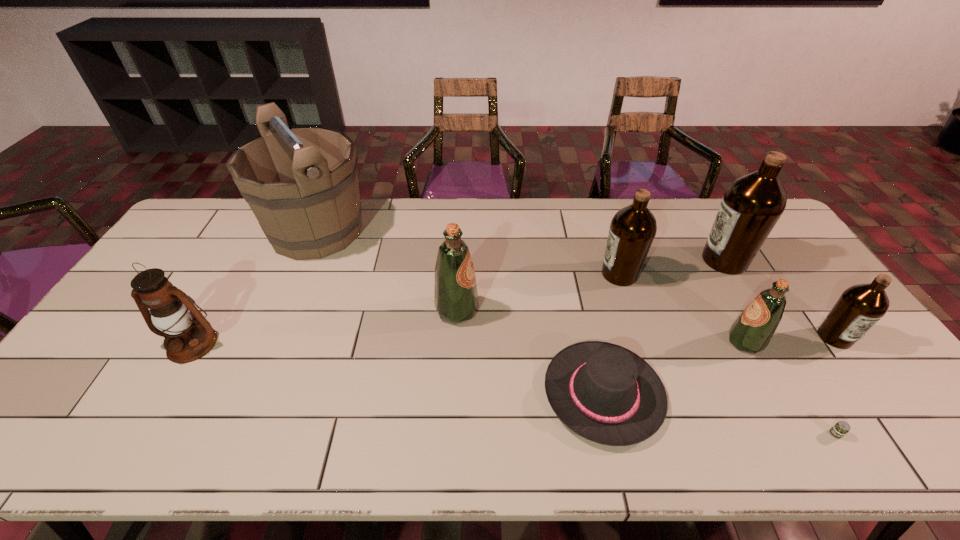
This screenshot has width=960, height=540. Find the location of `vacant point located between the biggest brown olive oil and the second smallest brown olive oil`. vacant point located between the biggest brown olive oil and the second smallest brown olive oil is located at coordinates (672, 267).

This screenshot has height=540, width=960. I want to click on blank region between the leftmost olive oil and the leftmost brown olive oil, so click(x=539, y=292).

At what (x,y) coordinates should I click in order to perform the action: click on free space between the bucket and the second brown olive oil from left to right. Please return your answer as a coordinate pair (x, y). The height and width of the screenshot is (540, 960). Looking at the image, I should click on (520, 246).

The height and width of the screenshot is (540, 960). What are the coordinates of `vacant space that is in between the second brown olive oil from right to left and the beer can` in the screenshot? It's located at (780, 347).

Image resolution: width=960 pixels, height=540 pixels. I want to click on vacant space in between the beer can and the brown lantern, so click(514, 389).

This screenshot has width=960, height=540. In order to click on vacant point located between the rightmost object and the left green olive oil in this screenshot , I will do `click(646, 323)`.

Locate an element on the screen. object that is the fifth closest to the bucket is located at coordinates (752, 331).

I want to click on object that is the sixth closest to the smaller green olive oil, so click(455, 295).

This screenshot has height=540, width=960. I want to click on olive oil identified as the closest to the eighth tallest object, so click(455, 295).

Point out which olive oil is positioned as the third nearest to the smaller green olive oil. Please provide its 2D coordinates. Your answer should be formatted as a tuple, i.e. [(x, y)], where the tuple contains the x and y coordinates of a point satisfying the conditions above.

[(632, 230)]